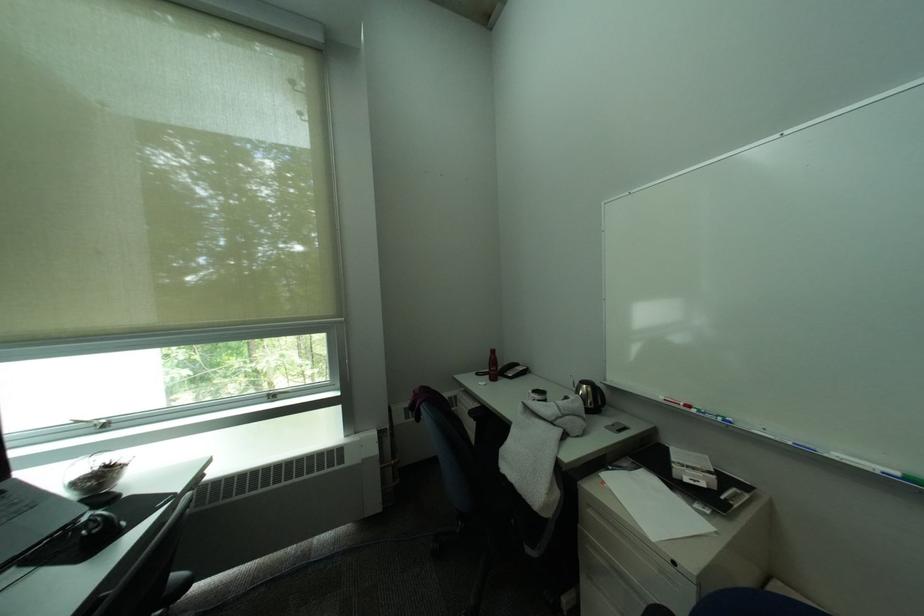
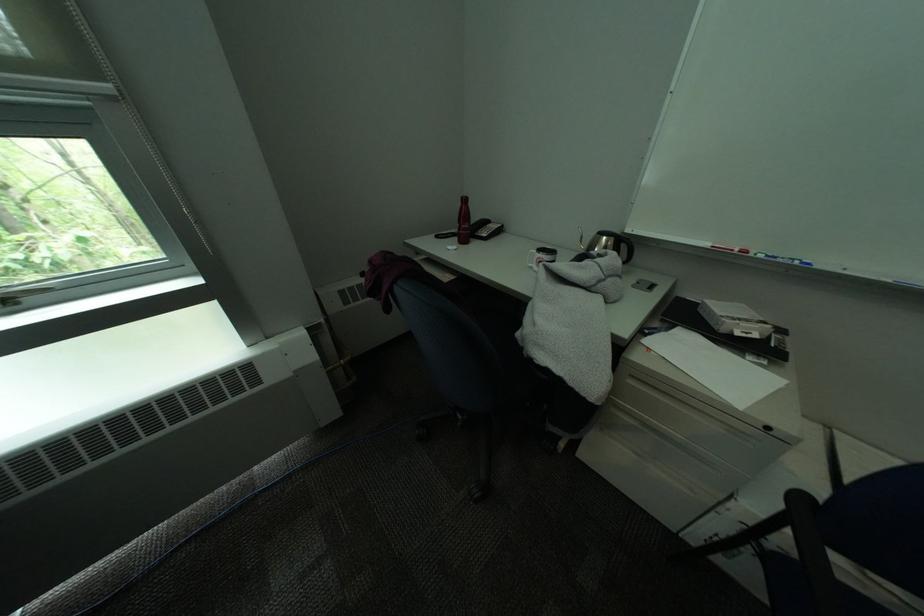
The point at (353, 320) is marked in the first image. Where is the corresponding point in the second image?

(119, 87)